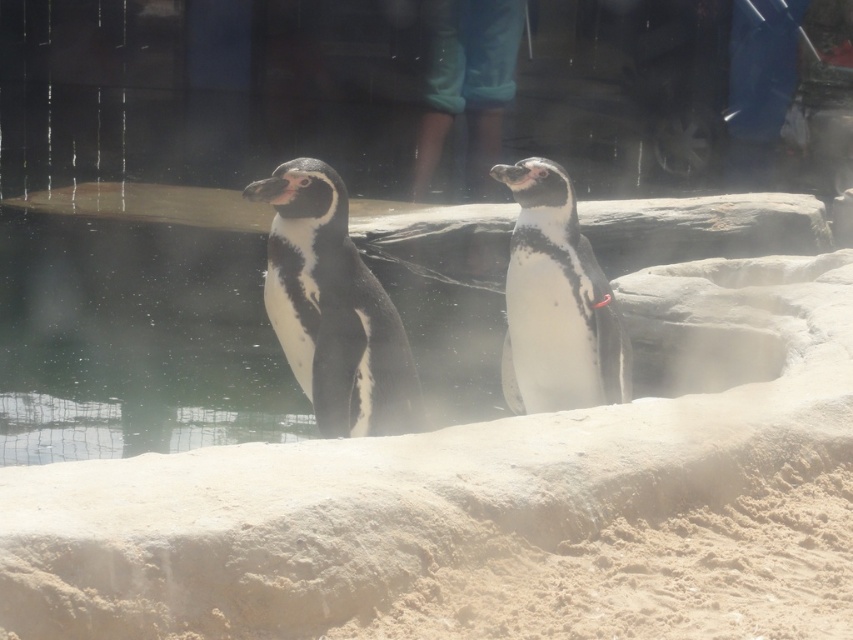
You are a zookeeper observing the penguins. You notice the white matte penguin at center and the smooth fabric pants at upper center. Which object is located to the right of the other?

The white matte penguin at center is positioned on the right side of smooth fabric pants at upper center.

You are a zookeeper who needs to place a divider between the black matte penguin at center and the white matte penguin at center to separate them temporarily. The divider you have is 80 centimeters wide. Will the divider fit perfectly between them?

The black matte penguin at center is 79.97 centimeters from the white matte penguin at center. Since the divider is 80 centimeters wide, it will be slightly wider than the distance between them, so it can fit with a small overlap on both sides.